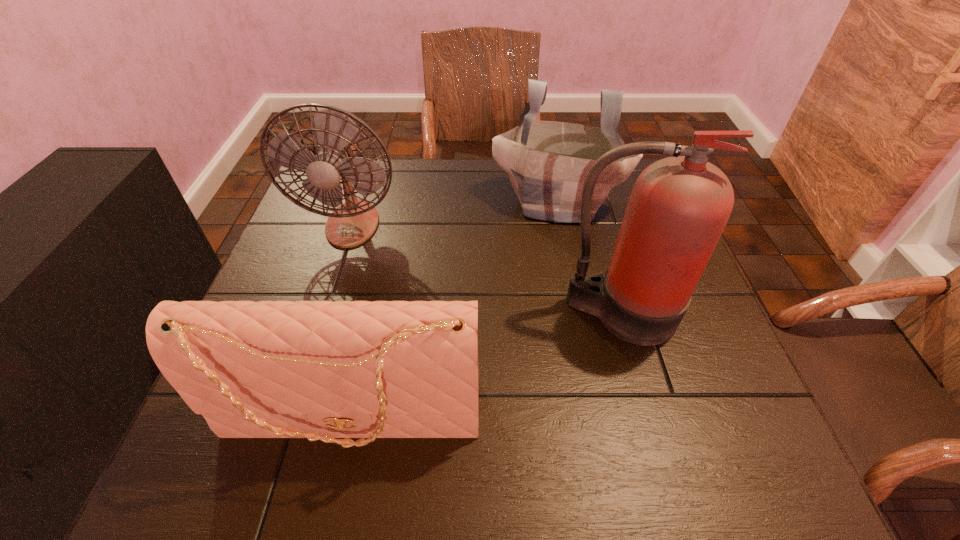
Find the location of a particular element. This screenshot has width=960, height=540. object at the near edge is located at coordinates (321, 370).

Find the location of `fan at the left edge`. fan at the left edge is located at coordinates (332, 153).

Identify the location of handbag that is at the left edge. (321, 370).

At what (x,y) coordinates should I click in order to perform the action: click on fire extinguisher located at the right edge. Please return your answer as a coordinate pair (x, y). Looking at the image, I should click on (679, 206).

Image resolution: width=960 pixels, height=540 pixels. I want to click on shopping bag that is positioned at the right edge, so click(547, 162).

Image resolution: width=960 pixels, height=540 pixels. I want to click on object that is at the far left corner, so click(332, 153).

Where is `object that is at the near left corner`? object that is at the near left corner is located at coordinates (321, 370).

The height and width of the screenshot is (540, 960). Find the location of `object that is at the far right corner`. object that is at the far right corner is located at coordinates (547, 162).

In the image, there is a desktop. Identify the location of free region at the far edge. Image resolution: width=960 pixels, height=540 pixels. (426, 185).

The image size is (960, 540). What are the coordinates of `vacant space at the near edge of the desktop` in the screenshot? It's located at (409, 457).